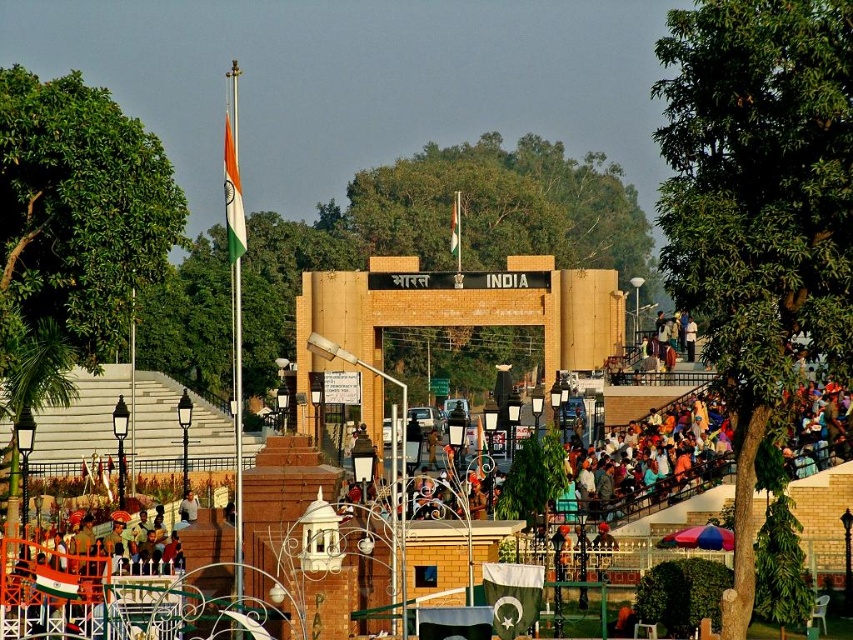
Based on the coordinates provided, which object is located at point (231, 196) in the image?

The point (231, 196) corresponds to the tri_color fabric flag at upper center.